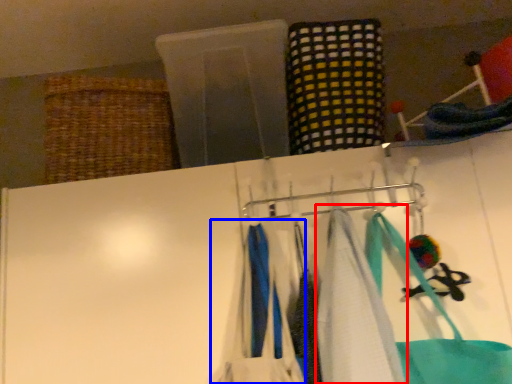
Question: Which object appears closest to the camera in this image, towel (highlighted by a red box) or clothing (highlighted by a blue box)?

Choices:
 (A) towel
 (B) clothing

Answer: (A)